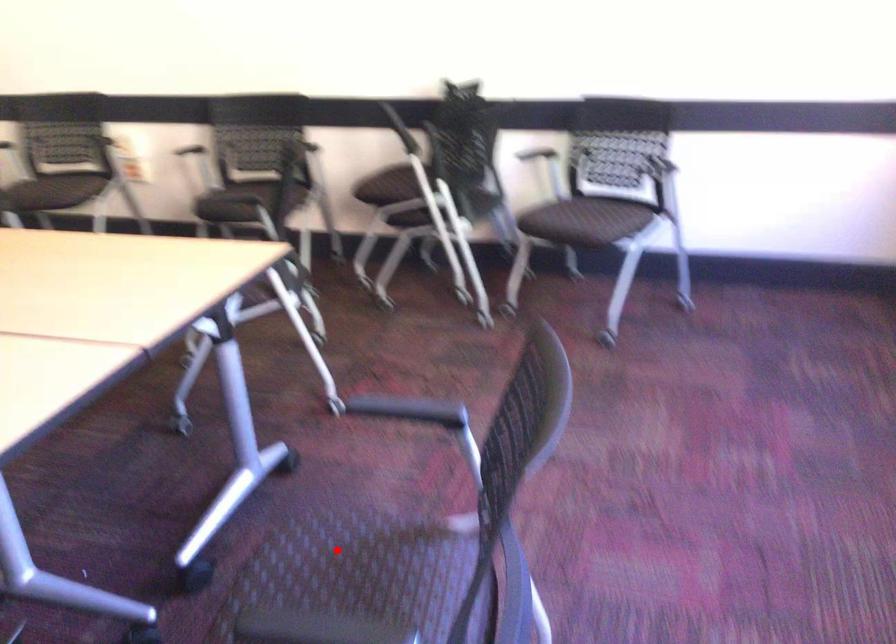
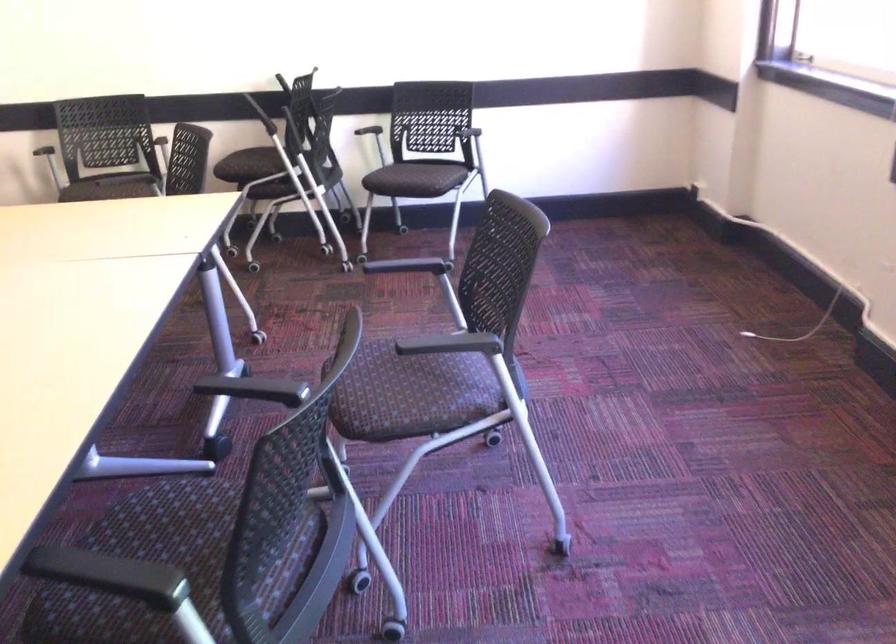
Question: I am providing you with two images of the same scene from different viewpoints. A red point is marked on the first image. Is the red point's position out of view in image 2?

Choices:
 (A) Yes
 (B) No

Answer: (B)